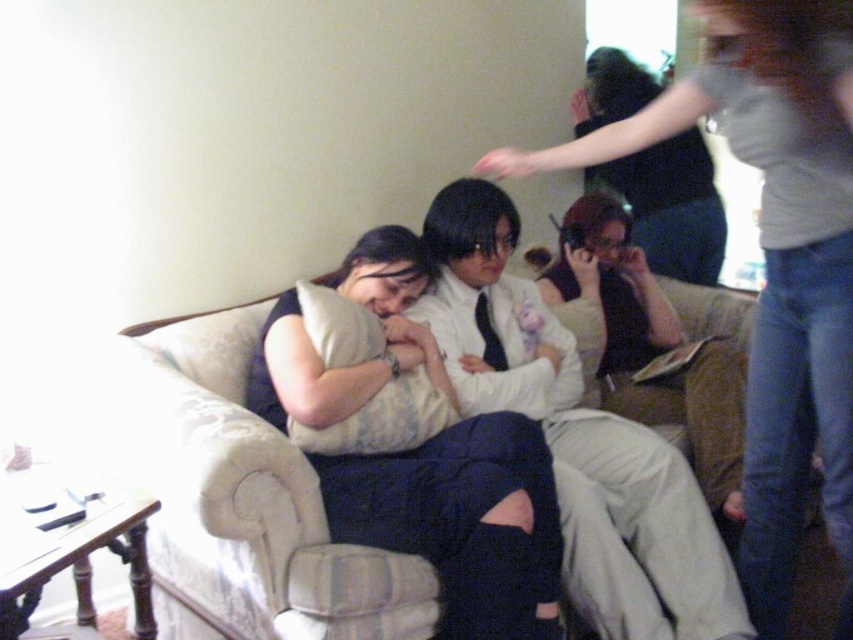
You are designing a layout for a magazine spread and need to place two elements based on their sizes. The elements are the matte black shirt at center and the white soft pillow at center. Given their sizes, which element should you place first to ensure proper scaling in the layout?

The matte black shirt at center is much taller than the white soft pillow at center, so you should place the matte black shirt at center first to account for its larger height in the layout.

You are a photographer adjusting your camera to focus on the matte white shirt at upper right and the beige fabric couch at center. Which object should you focus on first to ensure it appears sharp in the photo?

The matte white shirt at upper right is in front of the beige fabric couch at center, so you should focus on the matte white shirt at upper right first to ensure it appears sharp.